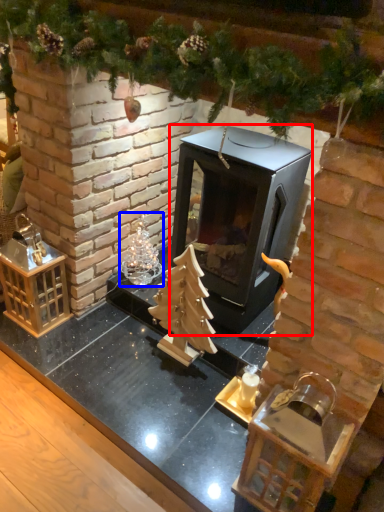
Question: Which of the following is the farthest to the observer, fireplace (highlighted by a red box) or christmas decoration (highlighted by a blue box)?

Choices:
 (A) fireplace
 (B) christmas decoration

Answer: (B)